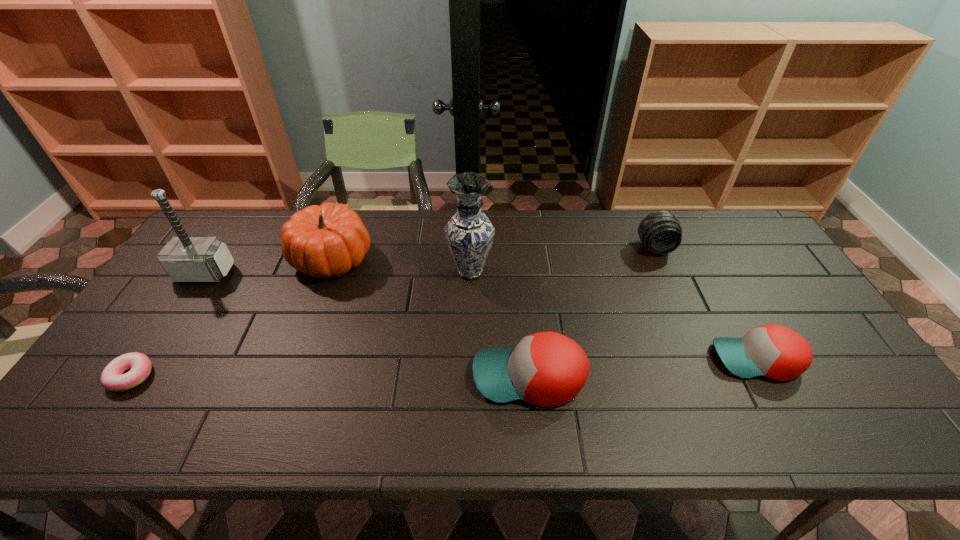
I want to click on telephoto lens that is at the far edge, so click(x=660, y=232).

In order to click on pumpkin that is at the far edge in this screenshot , I will do `click(328, 240)`.

Where is `doughnut present at the near edge`? doughnut present at the near edge is located at coordinates (112, 378).

The height and width of the screenshot is (540, 960). In order to click on hammer that is at the left edge in this screenshot , I will do `click(185, 259)`.

Where is `doughnut present at the left edge`? The image size is (960, 540). doughnut present at the left edge is located at coordinates (112, 378).

I want to click on object positioned at the right edge, so tap(773, 351).

Locate an element on the screen. object that is at the near left corner is located at coordinates (112, 378).

I want to click on object that is at the near right corner, so click(773, 351).

In the image, there is a desktop. Identify the location of vacant space at the far edge. The width and height of the screenshot is (960, 540). (516, 217).

Find the location of a particular element. vacant space at the near edge of the desktop is located at coordinates (666, 399).